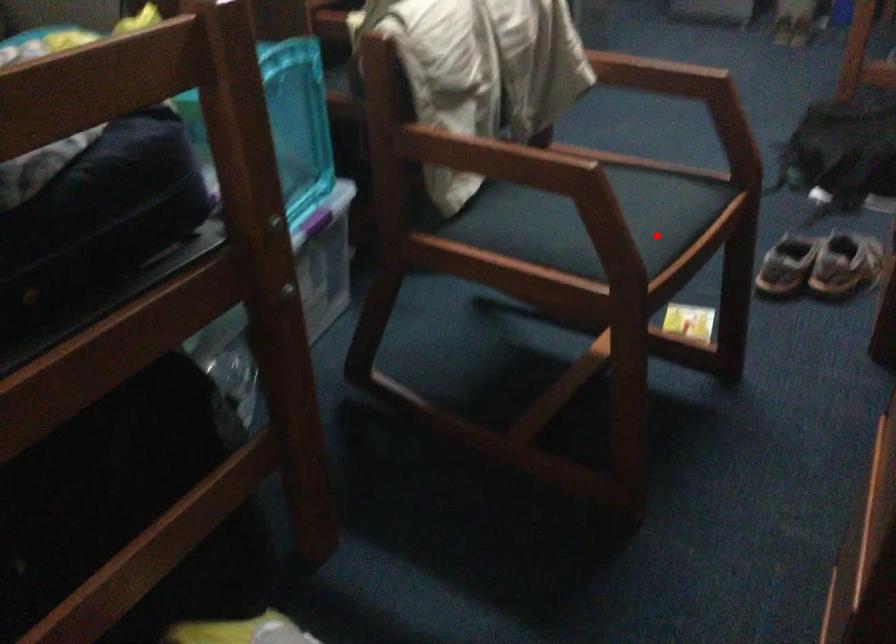
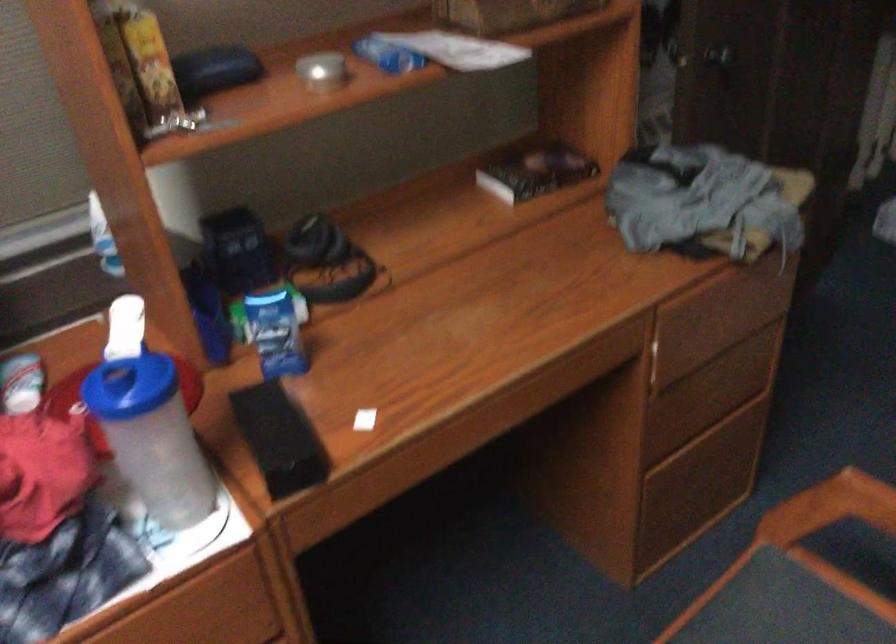
Find the pixel in the second image that matches the highlighted location in the first image.

(830, 507)